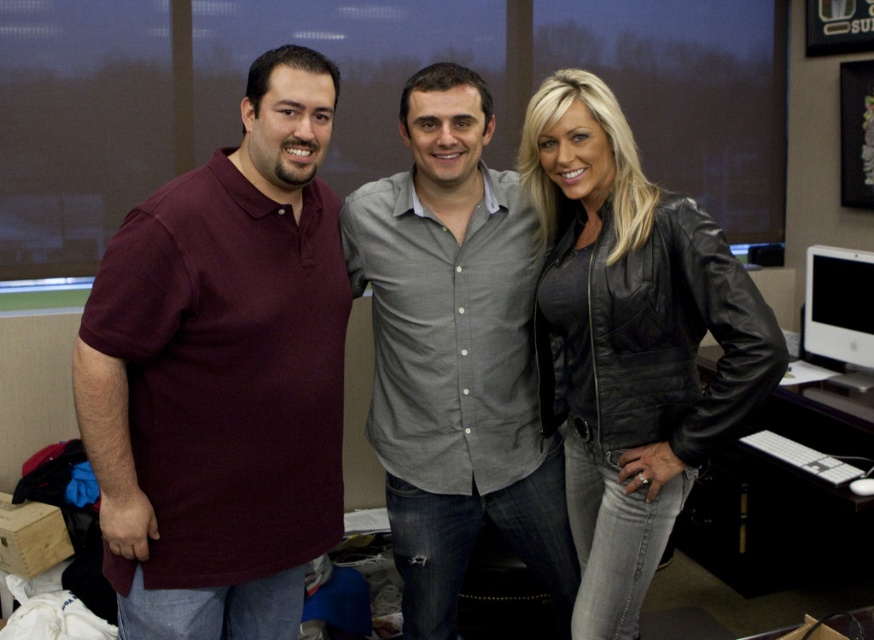
Question: Can you confirm if maroon polo shirt at left is wider than gray button-up shirt at center?

Choices:
 (A) no
 (B) yes

Answer: (A)

Question: Based on their relative distances, which object is nearer to the maroon polo shirt at left?

Choices:
 (A) black leather jacket at center
 (B) white glossy monitor at right
 (C) gray button-up shirt at center

Answer: (C)

Question: Which is nearer to the white glossy monitor at right?

Choices:
 (A) black leather jacket at center
 (B) gray button-up shirt at center

Answer: (A)

Question: Is black leather jacket at center positioned before white glossy monitor at right?

Choices:
 (A) no
 (B) yes

Answer: (B)

Question: Can you confirm if black leather jacket at center is positioned to the right of white glossy monitor at right?

Choices:
 (A) yes
 (B) no

Answer: (B)

Question: Which of these objects is positioned farthest from the white glossy monitor at right?

Choices:
 (A) black leather jacket at center
 (B) gray button-up shirt at center
 (C) maroon polo shirt at left

Answer: (C)